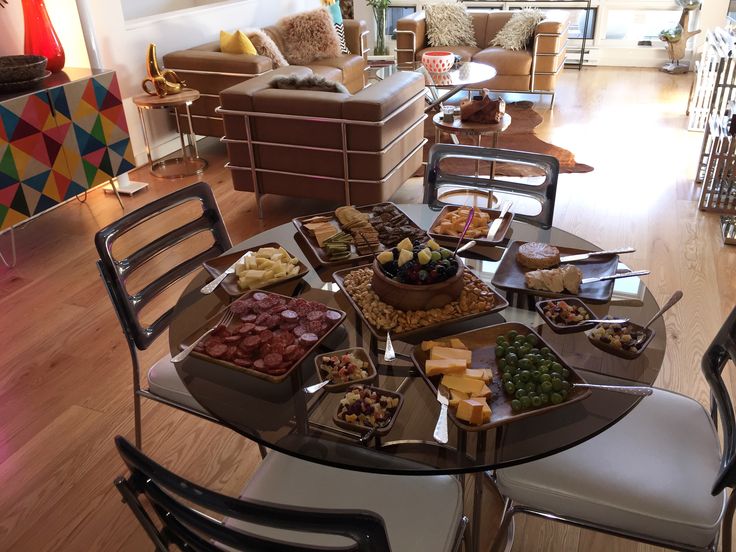
This screenshot has width=736, height=552. Identify the location of sofa. click(332, 56).